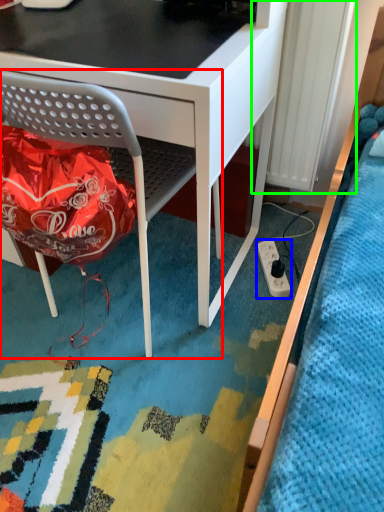
Question: Based on their relative distances, which object is farther from chair (highlighted by a red box)? Choose from power plugs and sockets (highlighted by a blue box) and radiator (highlighted by a green box).

Choices:
 (A) power plugs and sockets
 (B) radiator

Answer: (A)